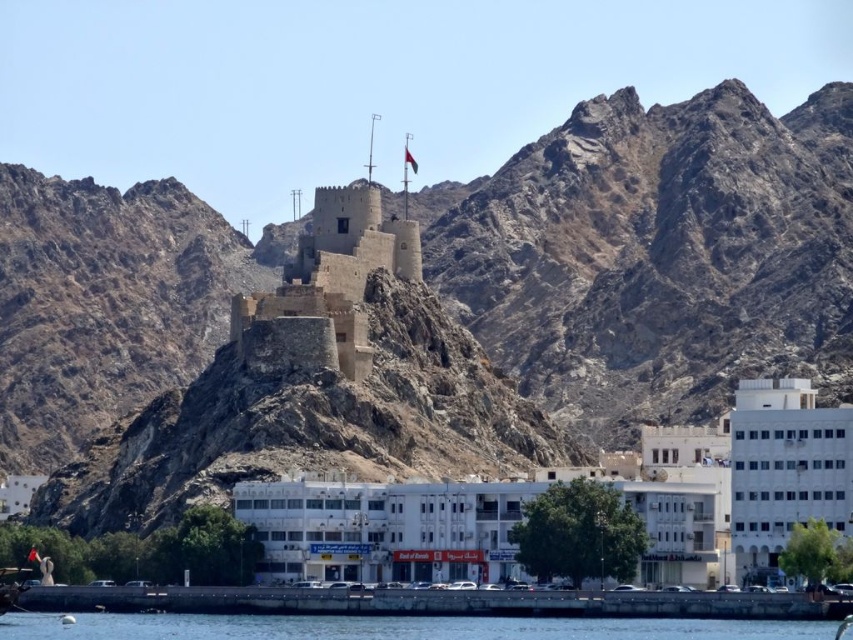
Question: Which object is the closest to the brown stone castle at center?

Choices:
 (A) brown rocky mountain at center
 (B) clear water at lower center

Answer: (B)

Question: Is brown rocky mountain at center smaller than black fabric flag at upper center?

Choices:
 (A) yes
 (B) no

Answer: (B)

Question: Which object appears farthest from the camera in this image?

Choices:
 (A) brown rocky mountain at center
 (B) black fabric flag at upper center
 (C) brown stone castle at center

Answer: (B)

Question: Can you confirm if brown stone castle at center is positioned to the left of black fabric flag at upper center?

Choices:
 (A) yes
 (B) no

Answer: (A)

Question: Can you confirm if clear water at lower center is positioned above black fabric flag at upper center?

Choices:
 (A) yes
 (B) no

Answer: (B)

Question: Which object is the farthest from the black fabric flag at upper center?

Choices:
 (A) clear water at lower center
 (B) brown rocky mountain at center

Answer: (A)